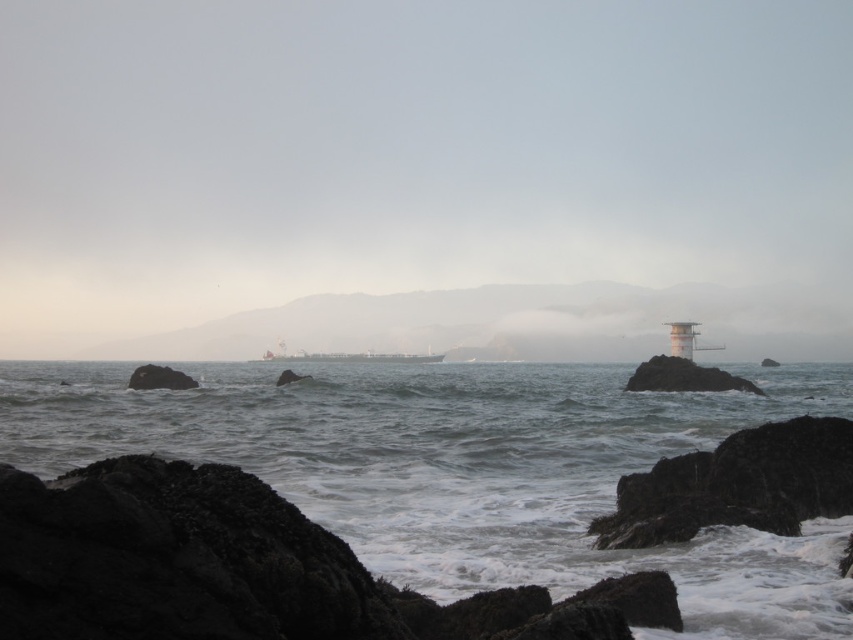
Does white foggy sky at upper center appear under dark gray rock at left?

Actually, white foggy sky at upper center is above dark gray rock at left.

Is point (642, 44) farther from viewer compared to point (184, 387)?

Yes, it is behind point (184, 387).

Does point (659, 182) lie behind point (158, 365)?

Yes, point (659, 182) is behind point (158, 365).

The height and width of the screenshot is (640, 853). I want to click on white foggy sky at upper center, so click(410, 154).

Can you confirm if white foggy sky at upper center is positioned to the right of metallic gray ship at center?

Yes, white foggy sky at upper center is to the right of metallic gray ship at center.

In the scene shown: Who is more distant from viewer, (741, 113) or (312, 356)?

Point (741, 113)

Identify the location of white foggy sky at upper center. (410, 154).

Does grayish water at center have a larger size compared to metallic gray ship at center?

Indeed, grayish water at center has a larger size compared to metallic gray ship at center.

Is grayish water at center to the left of metallic gray ship at center from the viewer's perspective?

In fact, grayish water at center is to the right of metallic gray ship at center.

Locate an element on the screen. The height and width of the screenshot is (640, 853). grayish water at center is located at coordinates (462, 468).